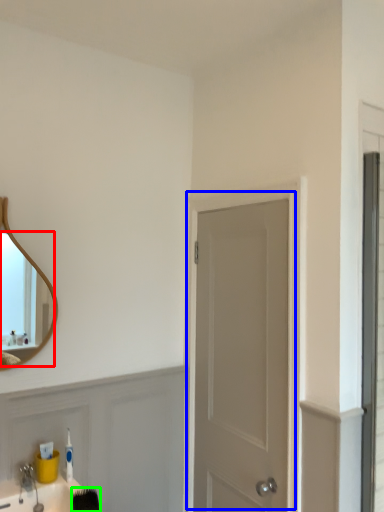
Question: Which object is the closest to the mirror (highlighted by a red box)? Choose among these: door (highlighted by a blue box) or brush (highlighted by a green box).

Choices:
 (A) door
 (B) brush

Answer: (B)